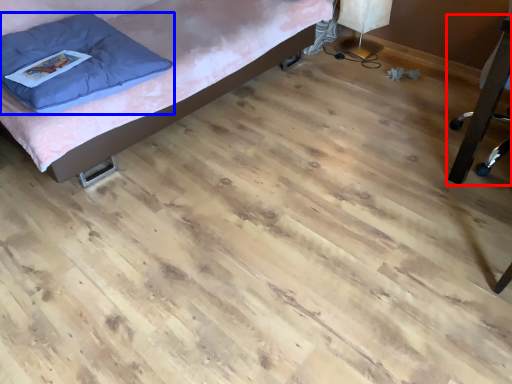
Question: Which of the following is the closest to the observer, furniture (highlighted by a red box) or pillow (highlighted by a blue box)?

Choices:
 (A) furniture
 (B) pillow

Answer: (A)